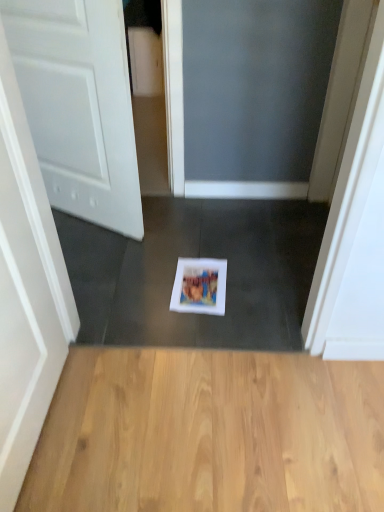
Question: Considering the relative positions of white matte door at left and white paper at center in the image provided, is white matte door at left to the left of white paper at center from the viewer's perspective?

Choices:
 (A) no
 (B) yes

Answer: (B)

Question: Is white matte door at left oriented away from white paper at center?

Choices:
 (A) no
 (B) yes

Answer: (A)

Question: Is the depth of white matte door at left less than that of white paper at center?

Choices:
 (A) no
 (B) yes

Answer: (B)

Question: Does white matte door at left have a lesser height compared to white paper at center?

Choices:
 (A) no
 (B) yes

Answer: (A)

Question: Is white matte door at left surrounding white paper at center?

Choices:
 (A) no
 (B) yes

Answer: (A)

Question: From the image's perspective, does white matte door at left appear higher than white paper at center?

Choices:
 (A) no
 (B) yes

Answer: (B)

Question: Are light brown wood flooring at center and white paper at center beside each other?

Choices:
 (A) yes
 (B) no

Answer: (B)

Question: Could you tell me if light brown wood flooring at center is facing white paper at center?

Choices:
 (A) yes
 (B) no

Answer: (A)

Question: Is light brown wood flooring at center thinner than white paper at center?

Choices:
 (A) no
 (B) yes

Answer: (A)

Question: Can you confirm if light brown wood flooring at center is positioned to the left of white paper at center?

Choices:
 (A) yes
 (B) no

Answer: (B)

Question: Considering the relative sizes of light brown wood flooring at center and white paper at center in the image provided, is light brown wood flooring at center smaller than white paper at center?

Choices:
 (A) no
 (B) yes

Answer: (A)

Question: From the image's perspective, is light brown wood flooring at center below white paper at center?

Choices:
 (A) yes
 (B) no

Answer: (A)

Question: Is white paper at center to the right of light brown wood flooring at center from the viewer's perspective?

Choices:
 (A) yes
 (B) no

Answer: (B)